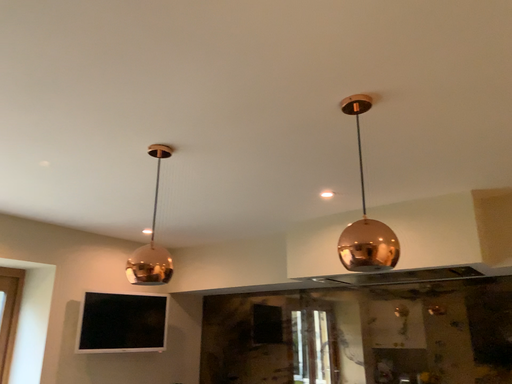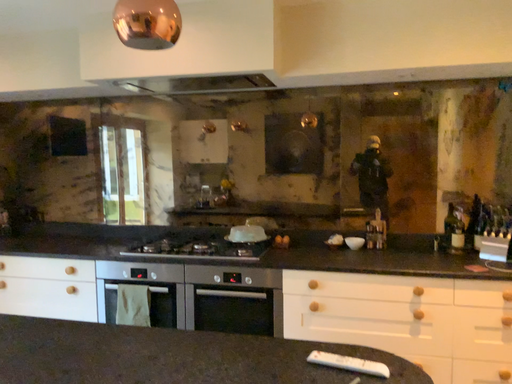
Question: How did the camera likely rotate when shooting the video?

Choices:
 (A) rotated left
 (B) rotated right

Answer: (B)